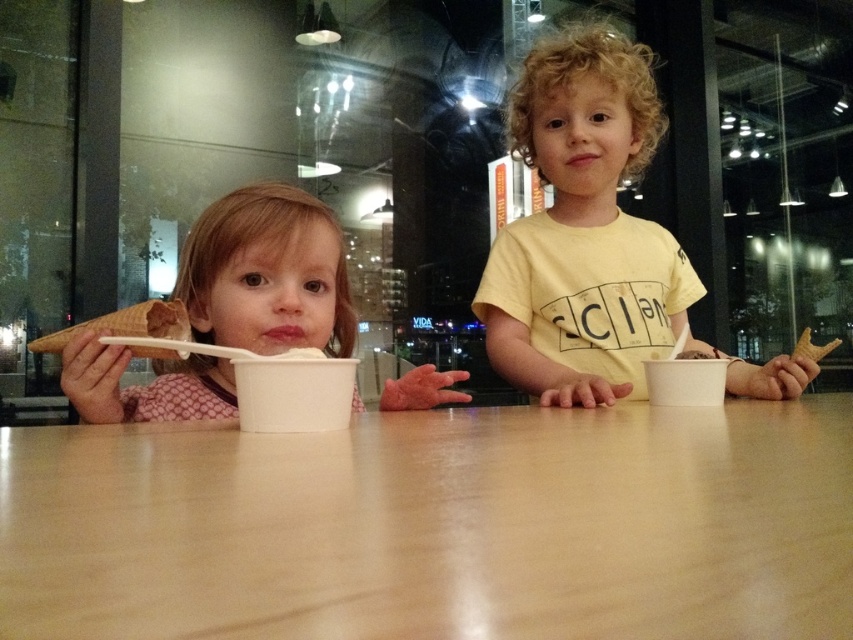
Question: Where is light brown wood table at center located in relation to pink fabric shirt at left in the image?

Choices:
 (A) right
 (B) left

Answer: (A)

Question: Which object is farther from the camera taking this photo?

Choices:
 (A) light brown wood table at center
 (B) white creamy ice cream at center
 (C) yellow matte shirt at center

Answer: (B)

Question: Which is nearer to the yellow matte shirt at center?

Choices:
 (A) white paper cup at center
 (B) light brown wood table at center
 (C) white creamy ice cream at center

Answer: (C)

Question: Among these points, which one is farthest from the camera?

Choices:
 (A) (59, 346)
 (B) (282, 506)
 (C) (593, 266)
 (D) (804, 344)

Answer: (C)

Question: Is light brown wood table at center behind white creamy ice cream at center?

Choices:
 (A) yes
 (B) no

Answer: (B)

Question: Does pink fabric shirt at left appear over white paper cup at center?

Choices:
 (A) no
 (B) yes

Answer: (B)